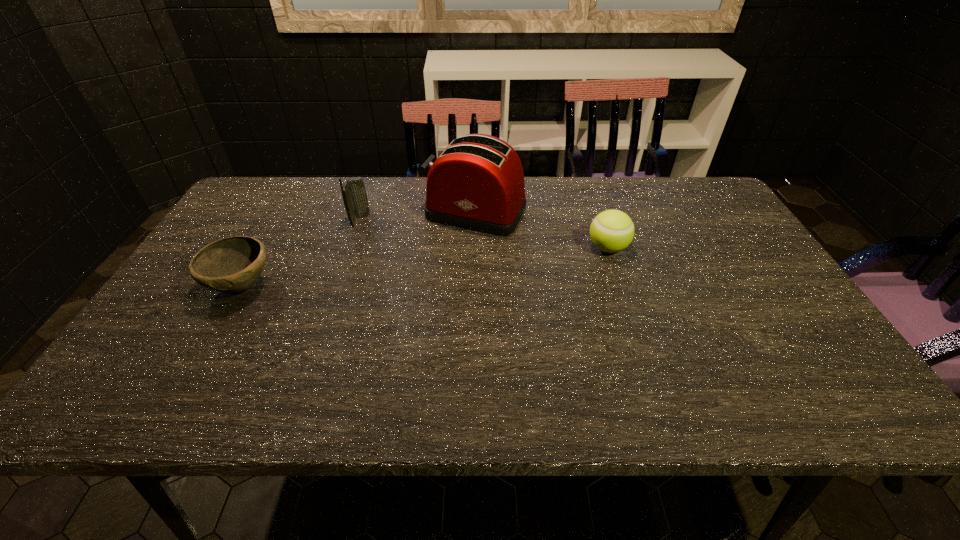
Locate an element on the screen. free space between the bowl and the tennis ball is located at coordinates (424, 267).

Image resolution: width=960 pixels, height=540 pixels. I want to click on free space between the tallest object and the rightmost object, so pyautogui.click(x=541, y=230).

Identify the location of empty space between the tallest object and the tennis ball. [x=541, y=230].

The height and width of the screenshot is (540, 960). In order to click on free space between the nearest object and the rightmost object in this screenshot , I will do `click(424, 267)`.

This screenshot has height=540, width=960. I want to click on free point between the cellular telephone and the toaster, so click(418, 216).

Locate an element on the screen. free space between the tallest object and the bowl is located at coordinates (358, 249).

The height and width of the screenshot is (540, 960). In order to click on unoccupied area between the third shortest object and the toaster in this screenshot , I will do `click(418, 216)`.

In order to click on vacant space in between the second tallest object and the tallest object in this screenshot , I will do `click(418, 216)`.

This screenshot has width=960, height=540. In order to click on free area in between the tennis ball and the tallest object in this screenshot , I will do `click(541, 230)`.

The height and width of the screenshot is (540, 960). Identify the location of blank region between the cellular telephone and the tennis ball. (484, 234).